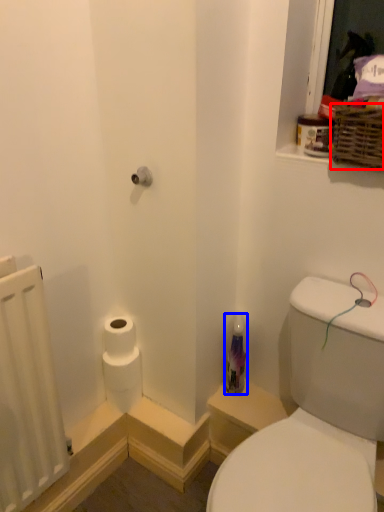
Question: Which point is further to the camera, basket (highlighted by a red box) or toiletry (highlighted by a blue box)?

Choices:
 (A) basket
 (B) toiletry

Answer: (B)